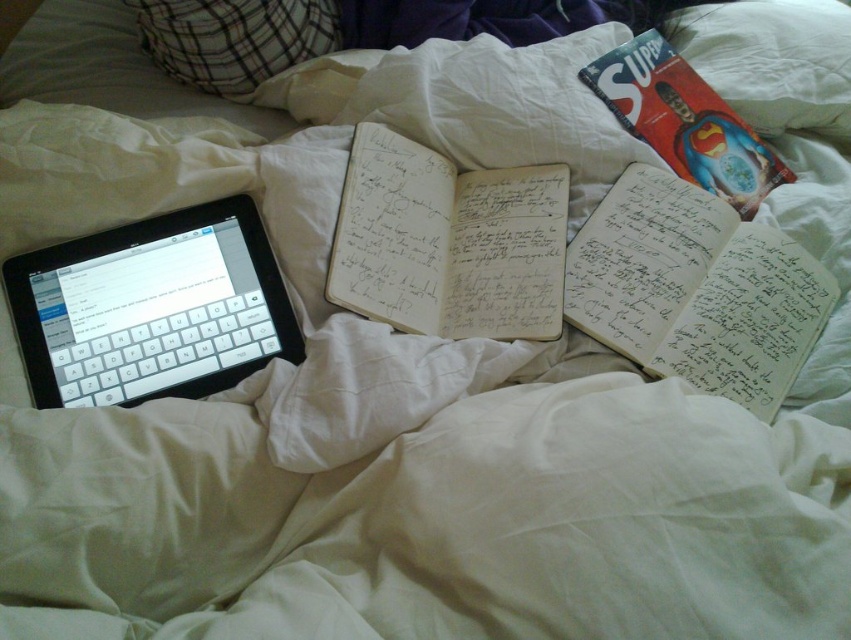
You are a photographer who wants to take a photo of the black matte tablet at left from a distance of 25 inches. Can you position yourself so that the camera is exactly 25 inches away from the tablet?

The black matte tablet at left and camera are 25.32 inches apart, so positioning the camera exactly 25 inches away from the tablet is possible as 25 inches is slightly closer than the current distance of 25.32 inches.

You are a student who needs to move a pencil from the black matte tablet at left to the white paper journal at center right. The pencil is 6 inches long. Can you place the pencil horizontally between them to bridge the gap?

The distance between the black matte tablet at left and white paper journal at center right is 15.59 inches. Since the pencil is only 6 inches long, it cannot span the gap. You would need a longer object to bridge the distance.